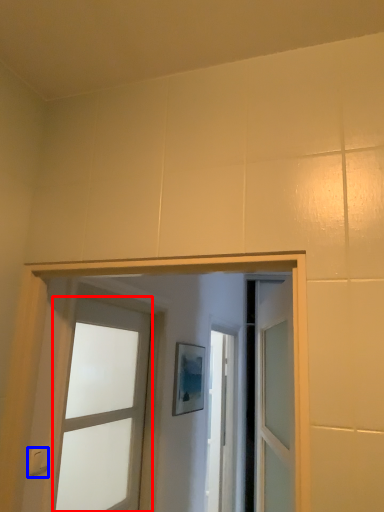
Question: Which point is further to the camera, door (highlighted by a red box) or light switch (highlighted by a blue box)?

Choices:
 (A) door
 (B) light switch

Answer: (A)